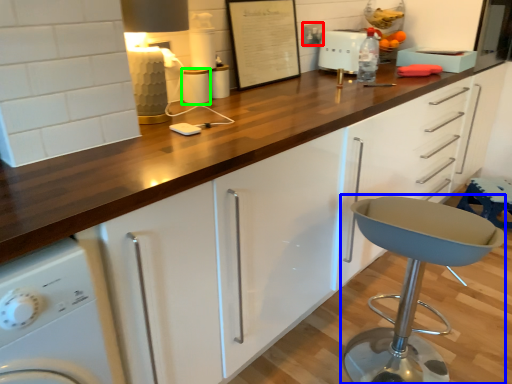
Question: Considering the real-world distances, which object is farthest from electric outlet (highlighted by a red box)? stool (highlighted by a blue box) or appliance (highlighted by a green box)?

Choices:
 (A) stool
 (B) appliance

Answer: (A)